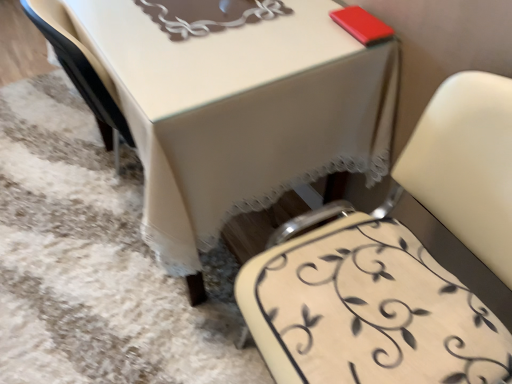
Question: Does white leather chair at center have a greater height compared to white lace tablecloth at center?

Choices:
 (A) no
 (B) yes

Answer: (B)

Question: From a real-world perspective, is white leather chair at center physically below white lace tablecloth at center?

Choices:
 (A) yes
 (B) no

Answer: (B)

Question: From a real-world perspective, is white leather chair at center over white lace tablecloth at center?

Choices:
 (A) yes
 (B) no

Answer: (A)

Question: Is white leather chair at center closer to the viewer compared to white lace tablecloth at center?

Choices:
 (A) yes
 (B) no

Answer: (A)

Question: Can you confirm if white leather chair at center is wider than white lace tablecloth at center?

Choices:
 (A) yes
 (B) no

Answer: (B)

Question: Considering the positions of point (322, 274) and point (366, 117), is point (322, 274) closer or farther from the camera than point (366, 117)?

Choices:
 (A) farther
 (B) closer

Answer: (B)

Question: Is white leather chair at center inside or outside of white lace tablecloth at center?

Choices:
 (A) inside
 (B) outside

Answer: (B)

Question: From their relative heights in the image, would you say white leather chair at center is taller or shorter than white lace tablecloth at center?

Choices:
 (A) tall
 (B) short

Answer: (A)

Question: Is white leather chair at center in front of or behind white lace tablecloth at center in the image?

Choices:
 (A) front
 (B) behind

Answer: (A)

Question: Considering their positions, is white leather chair at center located in front of or behind creamy leather chair at lower right?

Choices:
 (A) front
 (B) behind

Answer: (A)

Question: Considering the positions of white leather chair at center and creamy leather chair at lower right in the image, is white leather chair at center wider or thinner than creamy leather chair at lower right?

Choices:
 (A) thin
 (B) wide

Answer: (B)

Question: Is point (426, 294) positioned closer to the camera than point (318, 329)?

Choices:
 (A) farther
 (B) closer

Answer: (A)

Question: From the image's perspective, is white leather chair at center above or below creamy leather chair at lower right?

Choices:
 (A) above
 (B) below

Answer: (B)

Question: Is creamy leather chair at lower right taller or shorter than white leather chair at center?

Choices:
 (A) short
 (B) tall

Answer: (A)

Question: Based on their sizes in the image, would you say creamy leather chair at lower right is bigger or smaller than white leather chair at center?

Choices:
 (A) big
 (B) small

Answer: (B)